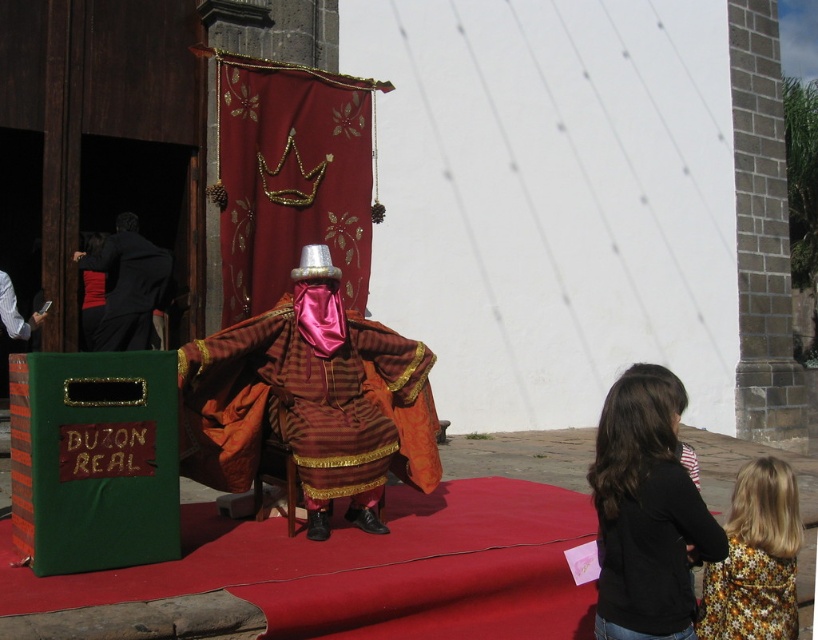
Looking at this image, you are an event planner arranging a photo shoot. You need to position the black cotton shirt at lower right and the black velvet robe at left in a way that maintains their current height relationship. Which object should be placed closer to the camera to ensure the height difference remains visible?

The black cotton shirt at lower right is not as tall as the black velvet robe at left. To maintain the height difference, the shorter black cotton shirt at lower right should be placed closer to the camera so its apparent size remains larger than the black velvet robe at left.

You are an event planner arranging a photo shoot for the cultural event. You need to position the shiny silk robe at center and the floral fabric dress at lower right in a way that maintains their visual hierarchy. Which object should be placed higher to emphasize its prominence?

The shiny silk robe at center should be placed higher since it has a greater height compared to the floral fabric dress at lower right, making it more prominent.

You are an event photographer positioned at the center of the stage. You notice the black cotton shirt at lower right in the scene. Based on its coordinates, can you determine if it is positioned to the left or right of the central figure?

The black cotton shirt at lower right is located at point 0.805 on the x and y axis, which places it to the right side of the central figure.